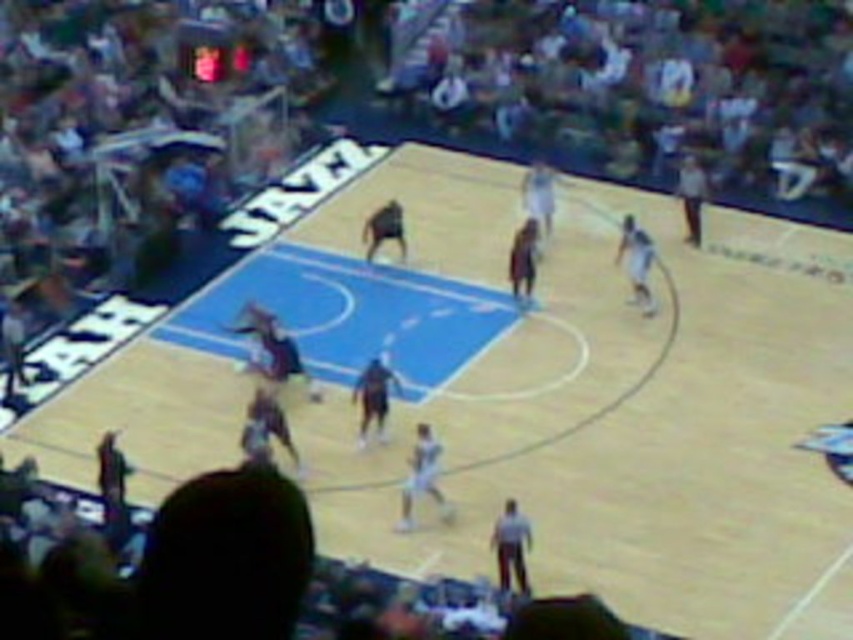
You are a photographer trying to capture a clear shot of both the light gray uniform at center and the dark brown jersey at center during the basketball game. Since the crowd is blurred, you decide to focus on the players wearing these uniforms. Which player should you focus on to ensure the uniform details are visible, considering their size?

The light gray uniform at center is bigger than the dark brown jersey at center, so focusing on the light gray uniform at center would allow for clearer details due to its larger size.

You are a photographer standing at the camera position. You want to take a closeup shot of the point at coordinates (364, 390) on the court. Considering the distance, will you need a zoom lens to capture it clearly?

The point at coordinates (364, 390) is 112.15 feet away from the camera. To capture such a distant point clearly, a zoom lens would be necessary to bring the subject into focus and fill the frame appropriately.